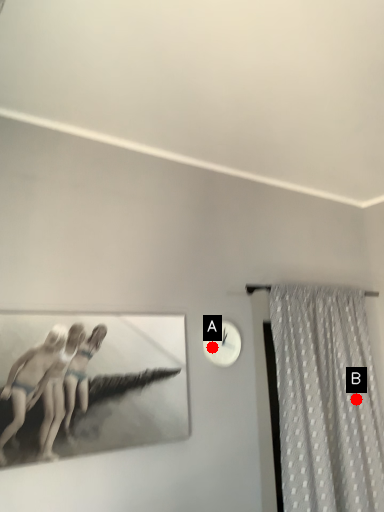
Question: Two points are circled on the image, labeled by A and B beside each circle. Among these points, which one is farthest from the camera?

Choices:
 (A) A is further
 (B) B is further

Answer: (B)